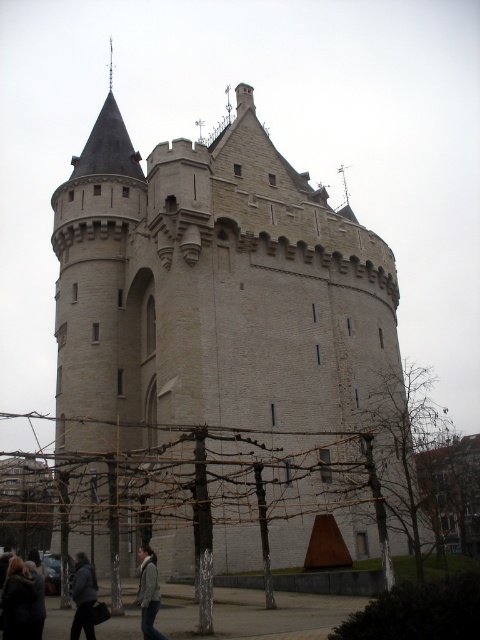
Question: In this image, where is dark brown leather jacket at lower left located relative to khaki fabric jacket at lower center?

Choices:
 (A) above
 (B) below

Answer: (A)

Question: Which object is positioned farthest from the beige stone castle at center?

Choices:
 (A) dark brown leather jacket at lower left
 (B) khaki fabric jacket at lower center
 (C) dark gray jacket at lower left

Answer: (A)

Question: Estimate the real-world distances between objects in this image. Which object is farther from the dark gray jacket at lower left?

Choices:
 (A) dark brown leather jacket at lower left
 (B) khaki fabric jacket at lower center

Answer: (A)

Question: Does dark brown leather jacket at lower left appear on the right side of dark gray jacket at lower left?

Choices:
 (A) no
 (B) yes

Answer: (A)

Question: Considering the real-world distances, which object is closest to the dark brown leather jacket at lower left?

Choices:
 (A) beige stone castle at center
 (B) dark gray jacket at lower left

Answer: (B)

Question: Can you confirm if beige stone castle at center is positioned below dark brown leather jacket at lower left?

Choices:
 (A) yes
 (B) no

Answer: (B)